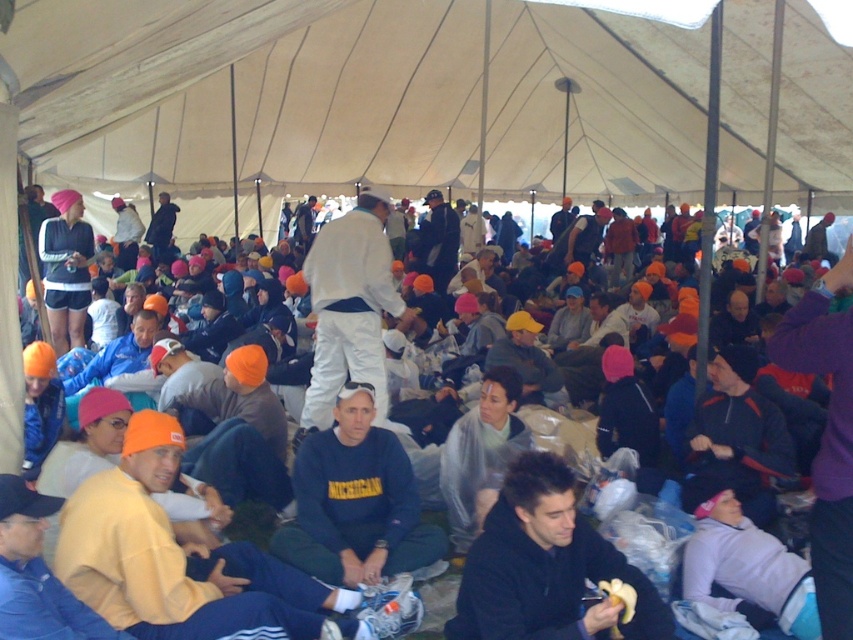
Question: Does orange knit cap at center appear over dark blue fleece at center?

Choices:
 (A) no
 (B) yes

Answer: (B)

Question: Is orange knit cap at center smaller than dark blue fleece at center?

Choices:
 (A) yes
 (B) no

Answer: (B)

Question: Which is nearer to the dark blue fleece at center?

Choices:
 (A) orange knit cap at center
 (B) black fleece jacket at center

Answer: (B)

Question: Does black fleece jacket at center lie behind dark blue fleece at center?

Choices:
 (A) no
 (B) yes

Answer: (A)

Question: Which point appears farthest from the camera in this image?

Choices:
 (A) (548, 500)
 (B) (445, 545)

Answer: (B)

Question: Which point is closer to the camera?

Choices:
 (A) (552, 552)
 (B) (320, 563)

Answer: (A)